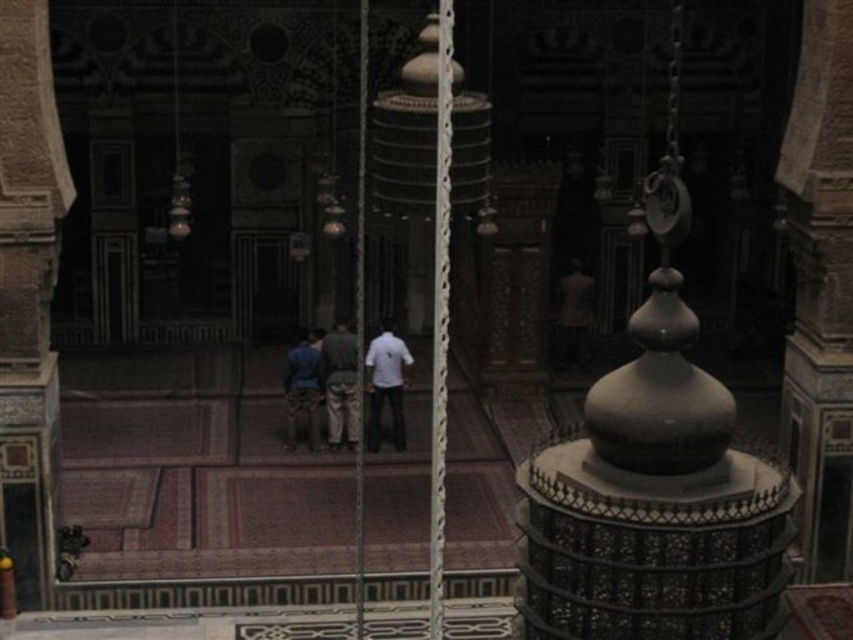
Question: Can you confirm if white matte shirt at center is smaller than blue fabric pants at center?

Choices:
 (A) yes
 (B) no

Answer: (B)

Question: Which object is farther from the camera taking this photo?

Choices:
 (A) light brown fabric pants at center
 (B) white matte shirt at center
 (C) blue fabric pants at center

Answer: (B)

Question: Does light brown fabric pants at center lie in front of blue fabric pants at center?

Choices:
 (A) no
 (B) yes

Answer: (B)

Question: Considering the real-world distances, which object is farthest from the blue fabric pants at center?

Choices:
 (A) light brown fabric pants at center
 (B) white matte shirt at center

Answer: (B)

Question: Estimate the real-world distances between objects in this image. Which object is farther from the white matte shirt at center?

Choices:
 (A) blue fabric pants at center
 (B) light brown fabric pants at center

Answer: (A)

Question: Is white matte shirt at center thinner than blue fabric pants at center?

Choices:
 (A) no
 (B) yes

Answer: (A)